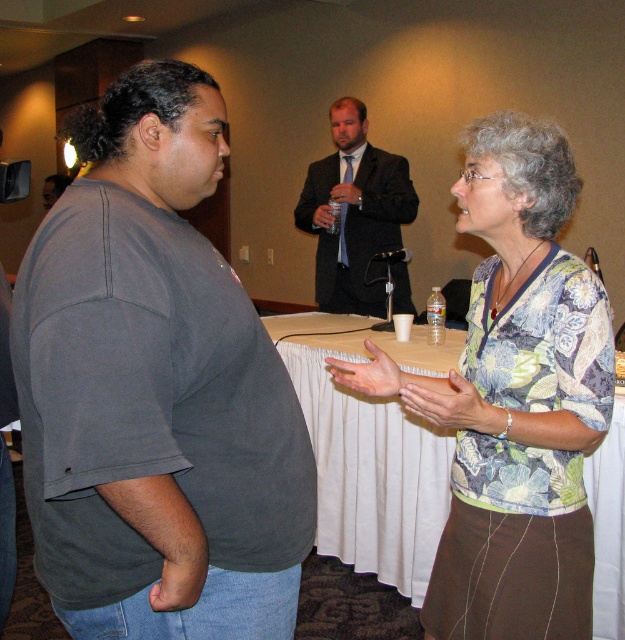
Question: Does dark gray t-shirt at left have a smaller size compared to floral fabric blouse at center?

Choices:
 (A) yes
 (B) no

Answer: (A)

Question: Which point is farther from the camera taking this photo?

Choices:
 (A) (151, 378)
 (B) (518, 150)
 (C) (390, 180)

Answer: (C)

Question: Which of the following is the closest to the observer?

Choices:
 (A) dark gray suit at center
 (B) dark gray t-shirt at left
 (C) floral fabric blouse at center

Answer: (B)

Question: Does dark gray t-shirt at left have a lesser width compared to dark gray suit at center?

Choices:
 (A) yes
 (B) no

Answer: (A)

Question: Based on their relative distances, which object is nearer to the dark gray suit at center?

Choices:
 (A) floral fabric blouse at center
 (B) dark gray t-shirt at left

Answer: (A)

Question: Can you confirm if floral fabric blouse at center is positioned to the right of dark gray suit at center?

Choices:
 (A) no
 (B) yes

Answer: (B)